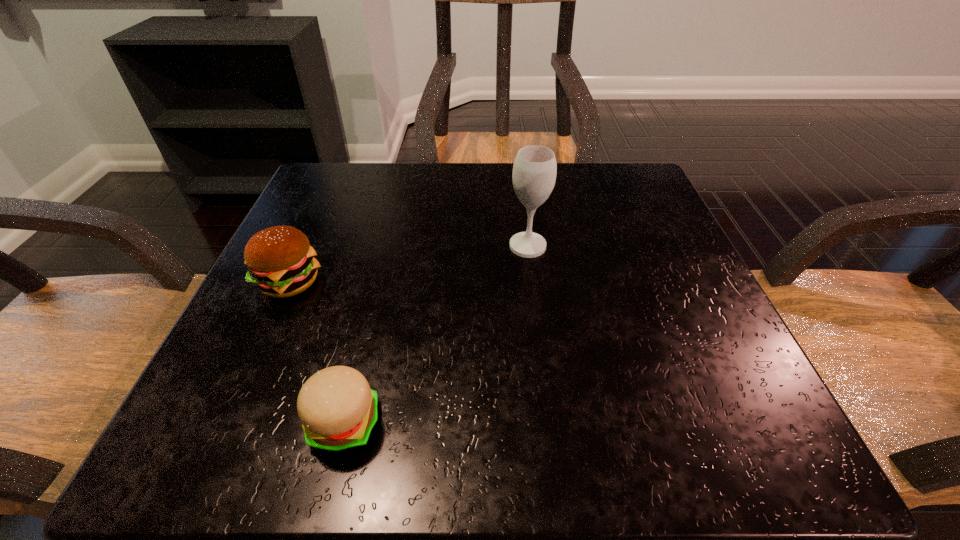
At what (x,y) coordinates should I click in order to perform the action: click on vacant space that's between the tallest object and the shortest object. Please return your answer as a coordinate pair (x, y). Looking at the image, I should click on (436, 335).

Locate an element on the screen. The width and height of the screenshot is (960, 540). vacant area between the nearest object and the tallest object is located at coordinates (436, 335).

What are the coordinates of `free area in between the second nearest object and the second object from left to right` in the screenshot? It's located at (317, 353).

Locate an element on the screen. Image resolution: width=960 pixels, height=540 pixels. empty location between the shortest object and the second farthest object is located at coordinates (317, 353).

This screenshot has height=540, width=960. Find the location of `vacant region between the wineglass and the left hamburger`. vacant region between the wineglass and the left hamburger is located at coordinates (409, 264).

This screenshot has height=540, width=960. I want to click on empty space between the right hamburger and the second farthest object, so click(x=317, y=353).

You are a GUI agent. You are given a task and a screenshot of the screen. Output one action in this format:
    pyautogui.click(x=<x>, y=<y>)
    Task: Click on the vacant point located between the farther hamburger and the shorter hamburger
    
    Given the screenshot: What is the action you would take?
    pyautogui.click(x=317, y=353)

Locate which object ranks second in proximity to the wineglass. Please provide its 2D coordinates. Your answer should be formatted as a tuple, i.e. [(x, y)], where the tuple contains the x and y coordinates of a point satisfying the conditions above.

[(338, 410)]

Locate which object ranks second in proximity to the rightmost object. Please provide its 2D coordinates. Your answer should be formatted as a tuple, i.e. [(x, y)], where the tuple contains the x and y coordinates of a point satisfying the conditions above.

[(338, 410)]

Locate an element on the screen. vacant region that satisfies the following two spatial constraints: 1. on the front side of the leftmost object; 2. on the right side of the nearest object is located at coordinates (225, 423).